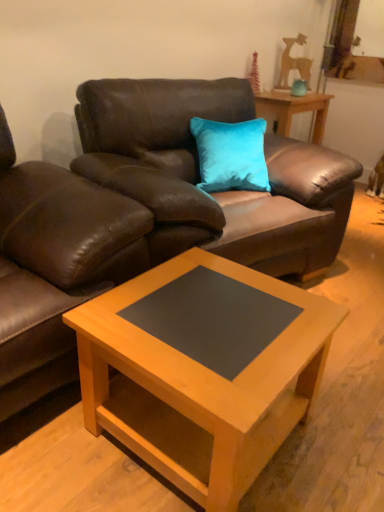
You are a GUI agent. You are given a task and a screenshot of the screen. Output one action in this format:
    pyautogui.click(x=<x>, y=<y>)
    Task: Click on the brown leather swivel chair at left
    The height and width of the screenshot is (512, 384).
    Given the screenshot: What is the action you would take?
    pyautogui.click(x=55, y=267)

The image size is (384, 512). What do you see at coordinates (145, 215) in the screenshot?
I see `brown leather couch at upper center` at bounding box center [145, 215].

Where is `brown leather couch at upper center`? This screenshot has height=512, width=384. brown leather couch at upper center is located at coordinates (145, 215).

What is the approximate width of teal velvet vase at upper right?

11.51 centimeters.

At what (x,y) coordinates should I click in order to perform the action: click on brown leather swivel chair at left. Please return your answer as a coordinate pair (x, y). Image resolution: width=384 pixels, height=512 pixels. Looking at the image, I should click on (55, 267).

Relative to brown leather couch at upper center, is teal velvet vase at upper right in front or behind?

Clearly, teal velvet vase at upper right is behind brown leather couch at upper center.

Image resolution: width=384 pixels, height=512 pixels. I want to click on teal above the brown leather couch at upper center (from the image's perspective), so click(299, 88).

Can we say teal velvet vase at upper right lies outside brown leather couch at upper center?

Yes.

Based on the photo, considering the relative sizes of light wood/black laminate coffee table at center and wooden table at center in the image provided, is light wood/black laminate coffee table at center smaller than wooden table at center?

No, light wood/black laminate coffee table at center is not smaller than wooden table at center.

Based on the photo, is light wood/black laminate coffee table at center not inside wooden table at center?

Yes, light wood/black laminate coffee table at center is not within wooden table at center.

From the image's perspective, is light wood/black laminate coffee table at center located above or below wooden table at center?

light wood/black laminate coffee table at center is situated lower than wooden table at center in the image.

Considering their positions, is wooden table at center located in front of or behind brown leather couch at upper center?

In the image, wooden table at center appears behind brown leather couch at upper center.

Considering the sizes of objects wooden table at center and brown leather couch at upper center in the image provided, who is smaller, wooden table at center or brown leather couch at upper center?

Smaller between the two is wooden table at center.

Is wooden table at center facing towards brown leather couch at upper center?

No.

Who is taller, wooden table at center or brown leather couch at upper center?

brown leather couch at upper center.

Which is more to the right, brown leather couch at upper center or teal velvet vase at upper right?

From the viewer's perspective, teal velvet vase at upper right appears more on the right side.

Is brown leather couch at upper center in front of or behind teal velvet vase at upper right in the image?

In the image, brown leather couch at upper center appears in front of teal velvet vase at upper right.

Do you think brown leather couch at upper center is within teal velvet vase at upper right, or outside of it?

brown leather couch at upper center is spatially situated outside teal velvet vase at upper right.

From the picture: Considering the sizes of objects brown leather couch at upper center and light wood/black laminate coffee table at center in the image provided, who is wider, brown leather couch at upper center or light wood/black laminate coffee table at center?

With larger width is brown leather couch at upper center.

Relative to light wood/black laminate coffee table at center, is brown leather couch at upper center in front or behind?

brown leather couch at upper center is behind light wood/black laminate coffee table at center.

Which of these two, brown leather couch at upper center or light wood/black laminate coffee table at center, stands taller?

brown leather couch at upper center.

Which is more to the left, brown leather couch at upper center or light wood/black laminate coffee table at center?

From the viewer's perspective, light wood/black laminate coffee table at center appears more on the left side.

Can you tell me how much brown leather swivel chair at left and light wood/black laminate coffee table at center differ in facing direction?

They differ by 1.3 degrees in their facing directions.

Is brown leather swivel chair at left facing away from light wood/black laminate coffee table at center?

No, brown leather swivel chair at left is not facing away from light wood/black laminate coffee table at center.

Where is `swivel chair in front of the light wood/black laminate coffee table at center`? The image size is (384, 512). swivel chair in front of the light wood/black laminate coffee table at center is located at coordinates (55, 267).

Which is more to the left, brown leather swivel chair at left or light wood/black laminate coffee table at center?

brown leather swivel chair at left is more to the left.

Looking at this image, is brown leather swivel chair at left facing towards wooden table at center?

No.

Which object is further away from the camera, brown leather swivel chair at left or wooden table at center?

wooden table at center is further from the camera.

From the image's perspective, is brown leather swivel chair at left positioned above or below wooden table at center?

Clearly, from the image's perspective, brown leather swivel chair at left is below wooden table at center.

Who is taller, brown leather swivel chair at left or wooden table at center?

brown leather swivel chair at left.

Locate an element on the screen. studio couch that appears below the teal velvet vase at upper right (from the image's perspective) is located at coordinates (145, 215).

Identify the location of table behind the light wood/black laminate coffee table at center. (294, 110).

Which object lies further to the anchor point wooden table at center, teal velvet vase at upper right or brown leather swivel chair at left?

brown leather swivel chair at left lies further to wooden table at center than the other object.

Looking at the image, which one is located further to light wood/black laminate coffee table at center, brown leather couch at upper center or teal velvet vase at upper right?

teal velvet vase at upper right is positioned further to the anchor light wood/black laminate coffee table at center.

Consider the image. Which object lies nearer to the anchor point brown leather couch at upper center, brown leather swivel chair at left or teal velvet vase at upper right?

brown leather swivel chair at left is closer to brown leather couch at upper center.

Which object lies further to the anchor point light wood/black laminate coffee table at center, teal velvet vase at upper right or brown leather couch at upper center?

teal velvet vase at upper right is positioned further to the anchor light wood/black laminate coffee table at center.

Based on their spatial positions, is brown leather swivel chair at left or brown leather couch at upper center closer to teal velvet vase at upper right?

brown leather couch at upper center lies closer to teal velvet vase at upper right than the other object.

Looking at the image, which one is located closer to teal velvet vase at upper right, brown leather swivel chair at left or wooden table at center?

Based on the image, wooden table at center appears to be nearer to teal velvet vase at upper right.

When comparing their distances from light wood/black laminate coffee table at center, does brown leather couch at upper center or brown leather swivel chair at left seem further?

brown leather couch at upper center is further to light wood/black laminate coffee table at center.

From the image, which object appears to be nearer to wooden table at center, brown leather swivel chair at left or brown leather couch at upper center?

The object closer to wooden table at center is brown leather couch at upper center.

Locate an element on the screen. This screenshot has width=384, height=512. studio couch located between brown leather swivel chair at left and wooden table at center in the depth direction is located at coordinates tap(145, 215).

Locate an element on the screen. The width and height of the screenshot is (384, 512). table between brown leather couch at upper center and teal velvet vase at upper right along the z-axis is located at coordinates (294, 110).

This screenshot has width=384, height=512. In order to click on coffee table between brown leather swivel chair at left and teal velvet vase at upper right along the z-axis in this screenshot , I will do `click(203, 369)`.

You are a GUI agent. You are given a task and a screenshot of the screen. Output one action in this format:
    pyautogui.click(x=<x>, y=<y>)
    Task: Click on the studio couch located between light wood/black laminate coffee table at center and teal velvet vase at upper right in the depth direction
    Image resolution: width=384 pixels, height=512 pixels.
    Given the screenshot: What is the action you would take?
    pyautogui.click(x=145, y=215)